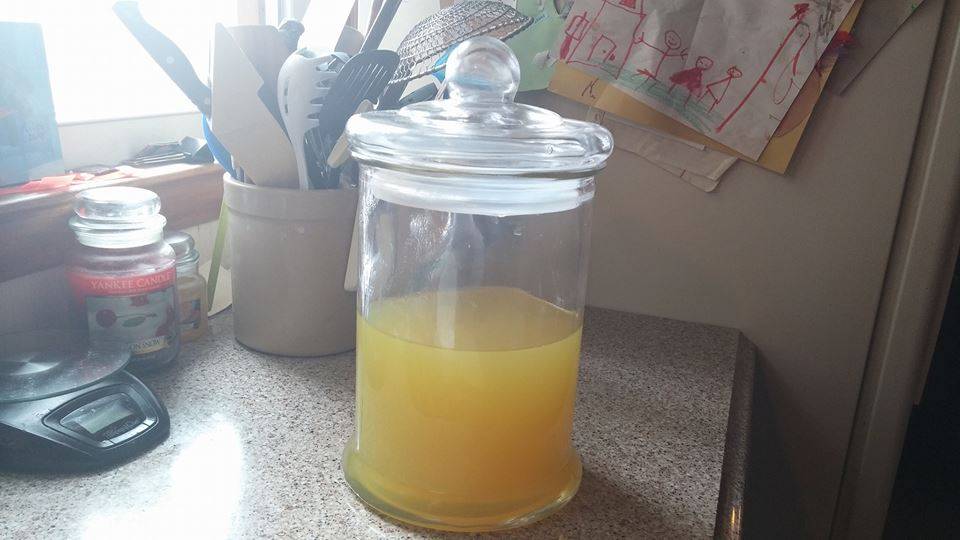
I want to click on 1 glass jar with juice, so click(x=468, y=452).